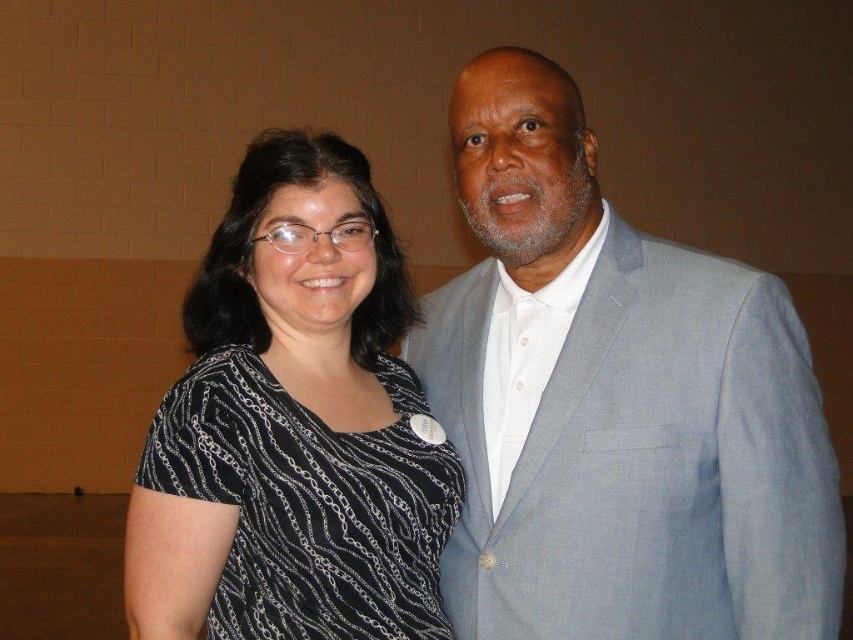
Is gray textured suit at center thinner than black printed shirt at left?

No.

Is point (572, 445) positioned in front of point (318, 234)?

Yes, point (572, 445) is in front of point (318, 234).

I want to click on gray textured suit at center, so click(614, 404).